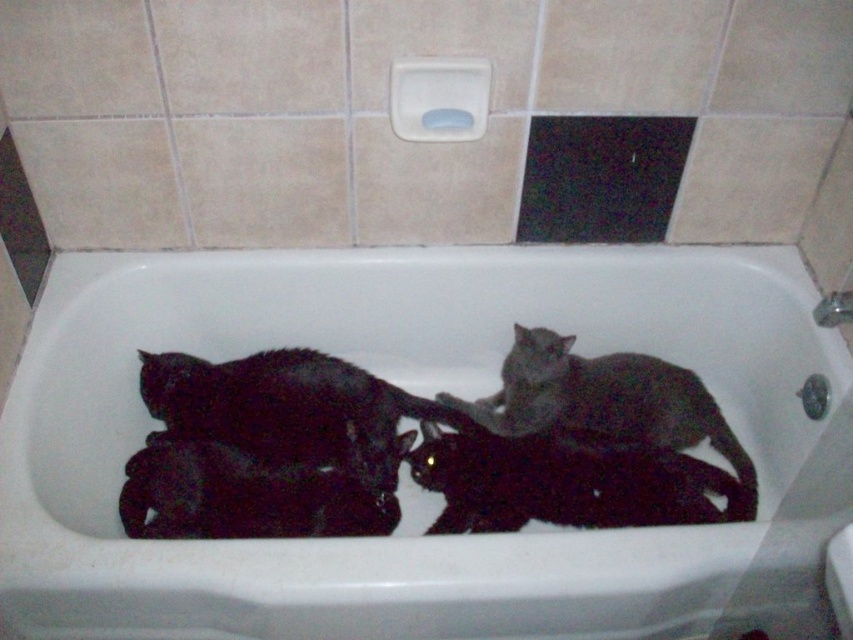
Is the position of black matte cat at center less distant than that of black matte cat at lower left?

No.

Between point (466, 502) and point (329, 513), which one is positioned in front?

Point (329, 513)

I want to click on black matte cat at center, so click(566, 484).

Can you confirm if black matte cat at center is positioned above gray matte cat at center?

Incorrect, black matte cat at center is not positioned above gray matte cat at center.

Can you confirm if black matte cat at center is shorter than gray matte cat at center?

Indeed, black matte cat at center has a lesser height compared to gray matte cat at center.

Does point (558, 499) come in front of point (535, 419)?

That is True.

At what (x,y) coordinates should I click in order to perform the action: click on black matte cat at center. Please return your answer as a coordinate pair (x, y). Looking at the image, I should click on (566, 484).

Can you confirm if white glossy bathtub at center is thinner than gray matte cat at center?

In fact, white glossy bathtub at center might be wider than gray matte cat at center.

Can you confirm if white glossy bathtub at center is taller than gray matte cat at center?

Yes.

Locate an element on the screen. The height and width of the screenshot is (640, 853). white glossy bathtub at center is located at coordinates (407, 481).